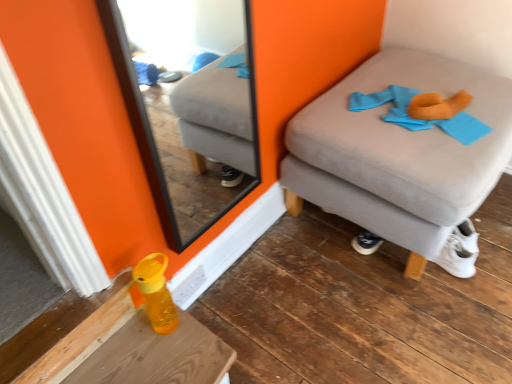
Question: Can you confirm if wooden table at lower left is taller than blue fabric at upper right?

Choices:
 (A) yes
 (B) no

Answer: (A)

Question: From a real-world perspective, is wooden table at lower left on top of blue fabric at upper right?

Choices:
 (A) yes
 (B) no

Answer: (B)

Question: Is blue fabric at upper right completely or partially inside wooden table at lower left?

Choices:
 (A) yes
 (B) no

Answer: (B)

Question: Is wooden table at lower left positioned with its back to blue fabric at upper right?

Choices:
 (A) yes
 (B) no

Answer: (B)

Question: Is wooden table at lower left outside of blue fabric at upper right?

Choices:
 (A) no
 (B) yes

Answer: (B)

Question: Is blue fabric at upper right wider or thinner than wooden table at lower left?

Choices:
 (A) thin
 (B) wide

Answer: (B)

Question: In the image, is blue fabric at upper right on the left side or the right side of wooden table at lower left?

Choices:
 (A) right
 (B) left

Answer: (A)

Question: From the image's perspective, is blue fabric at upper right above or below wooden table at lower left?

Choices:
 (A) below
 (B) above

Answer: (B)

Question: From a real-world perspective, relative to wooden table at lower left, is blue fabric at upper right vertically above or below?

Choices:
 (A) above
 (B) below

Answer: (A)

Question: Do you think translucent yellow bottle at lower left is within blue fabric at upper right, or outside of it?

Choices:
 (A) inside
 (B) outside

Answer: (B)

Question: Is translucent yellow bottle at lower left wider or thinner than blue fabric at upper right?

Choices:
 (A) thin
 (B) wide

Answer: (A)

Question: Visually, is translucent yellow bottle at lower left positioned to the left or to the right of blue fabric at upper right?

Choices:
 (A) left
 (B) right

Answer: (A)

Question: Is translucent yellow bottle at lower left taller or shorter than blue fabric at upper right?

Choices:
 (A) tall
 (B) short

Answer: (A)

Question: Would you say wooden table at lower left is inside or outside suede ottoman at right?

Choices:
 (A) inside
 (B) outside

Answer: (B)

Question: From the image's perspective, is wooden table at lower left positioned above or below suede ottoman at right?

Choices:
 (A) above
 (B) below

Answer: (B)